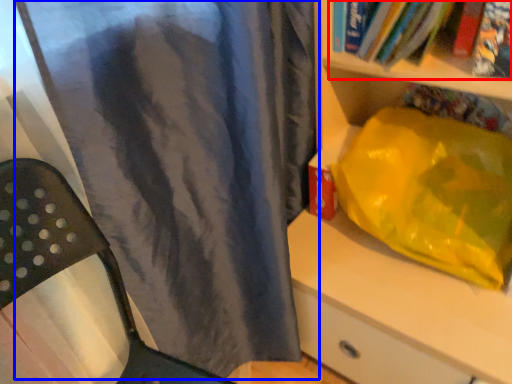
Question: Which object appears farthest to the camera in this image, book (highlighted by a red box) or curtain (highlighted by a blue box)?

Choices:
 (A) book
 (B) curtain

Answer: (A)